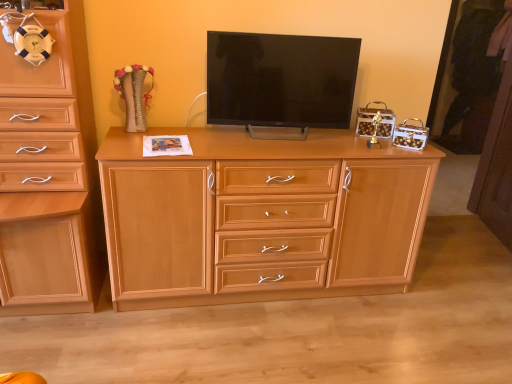
Locate an element on the screen. Image resolution: width=512 pixels, height=384 pixels. unoccupied region to the right of light wood chest of drawers at center, placed as the second chest of drawers when sorted from left to right is located at coordinates (434, 302).